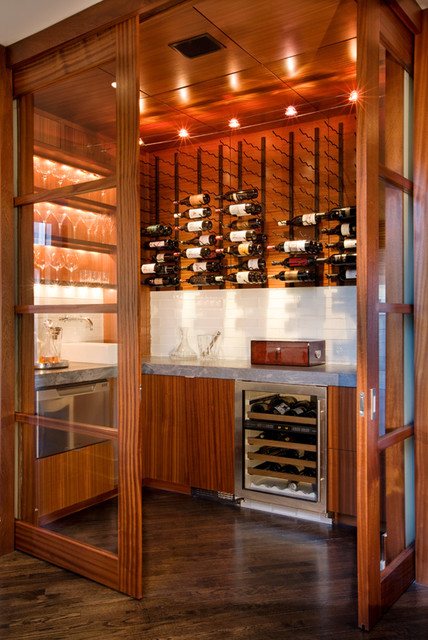
You are a GUI agent. You are given a task and a screenshot of the screen. Output one action in this format:
    pyautogui.click(x=<x>, y=<y>)
    Task: Click on the pitcher
    The width and height of the screenshot is (428, 640).
    Given the screenshot: What is the action you would take?
    pyautogui.click(x=49, y=348)